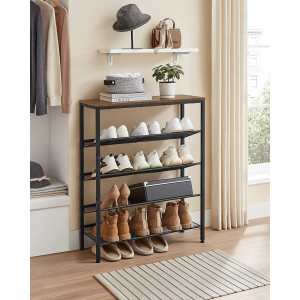
What are the coordinates of `shelves` in the screenshot? It's located at (157, 98), (164, 137), (164, 166), (161, 199), (166, 231).